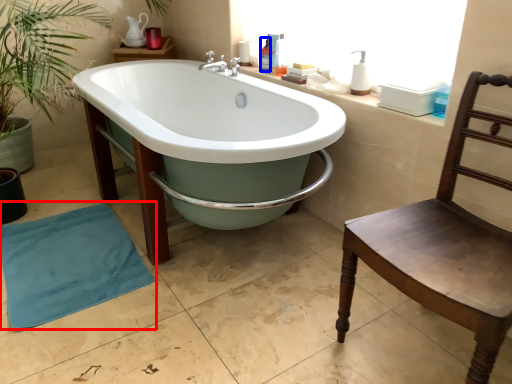
Question: Which object appears farthest to the camera in this image, beach towel (highlighted by a red box) or toiletry (highlighted by a blue box)?

Choices:
 (A) beach towel
 (B) toiletry

Answer: (B)